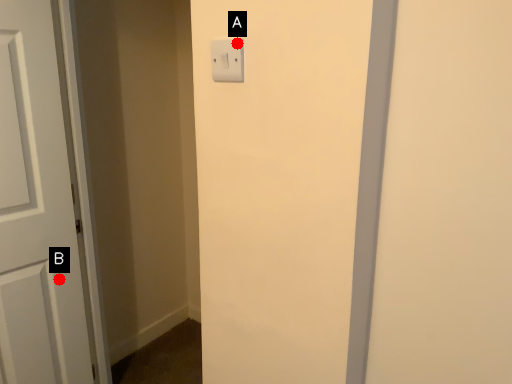
Question: Two points are circled on the image, labeled by A and B beside each circle. Which point is closer to the camera?

Choices:
 (A) A is closer
 (B) B is closer

Answer: (A)